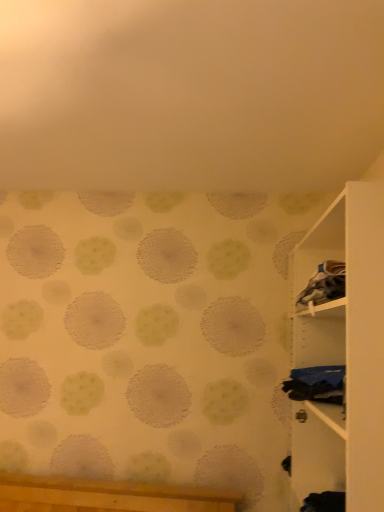
Describe the element at coordinates (344, 354) in the screenshot. I see `white wood shelf at right` at that location.

In order to face white wood shelf at right, should I rotate leftwards or rightwards?

Turn right by 20.077 degrees to look at white wood shelf at right.

Find the location of a particular element. white wood shelf at right is located at coordinates (344, 354).

Find the location of a particular element. The image size is (384, 512). white wood shelf at right is located at coordinates (344, 354).